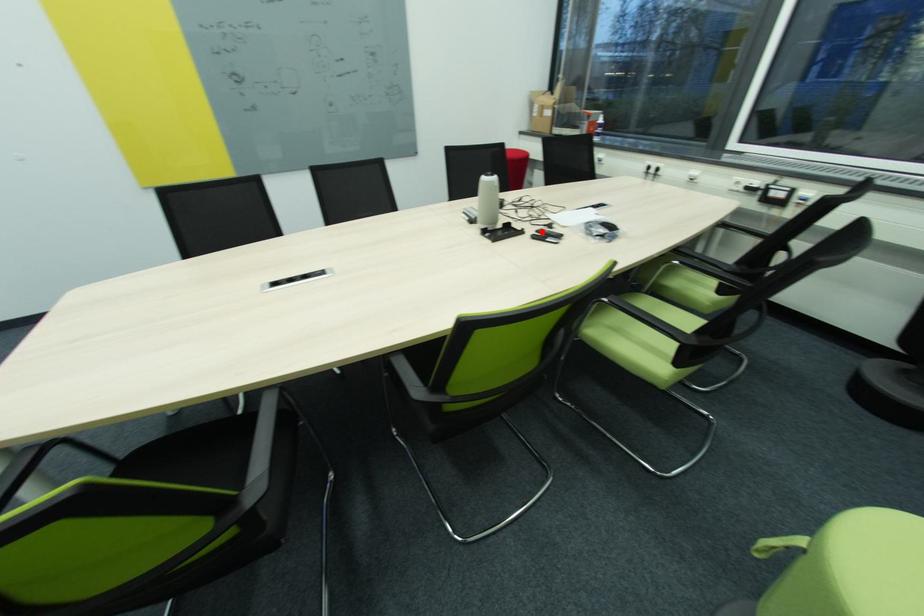
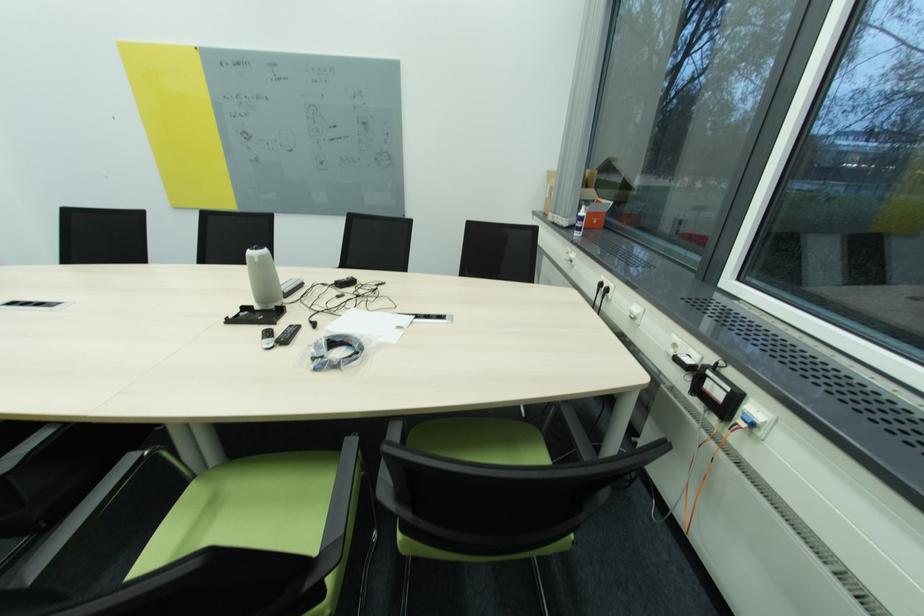
Find the pixel in the second image that matches the highlighted location in the first image.

(296, 328)